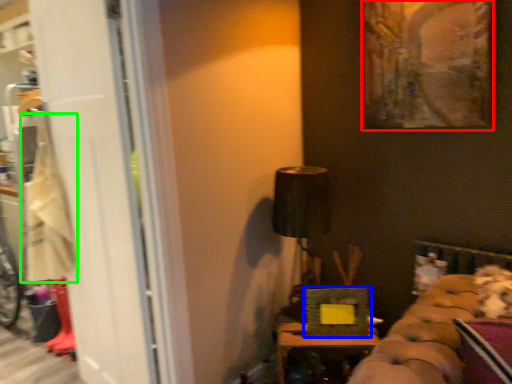
Question: Which object is positioned closest to picture frame (highlighted by a red box)? Select from picture frame (highlighted by a blue box) and laundry (highlighted by a green box).

Choices:
 (A) picture frame
 (B) laundry

Answer: (A)